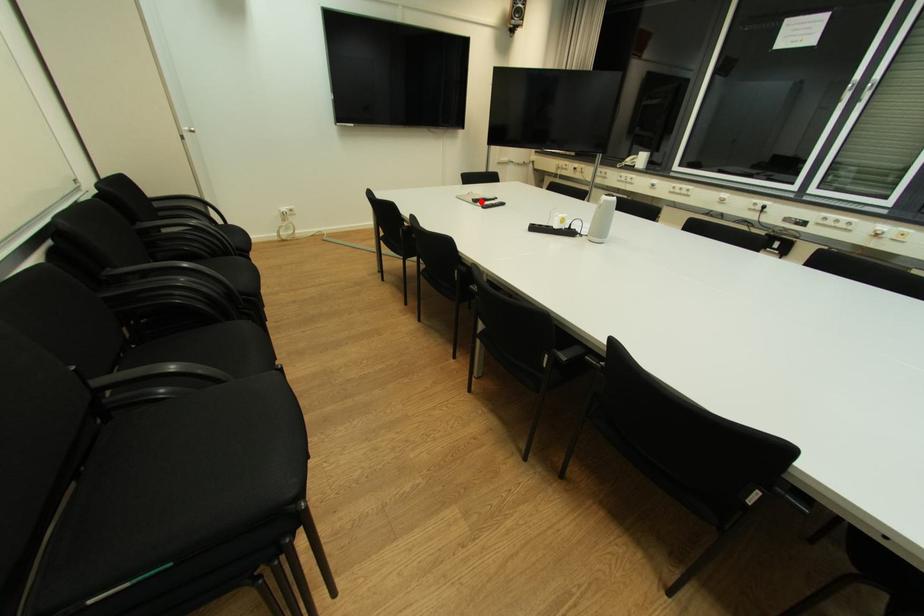
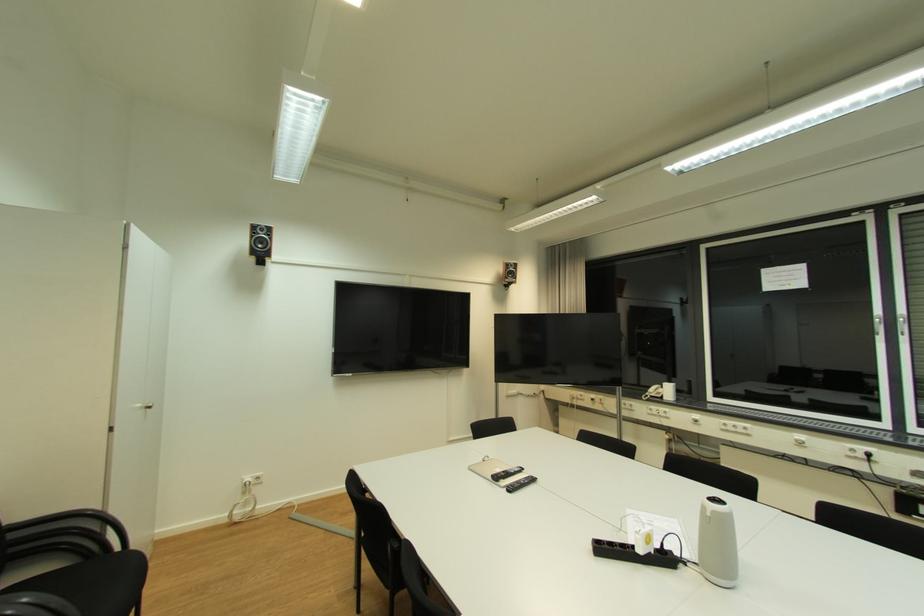
In the second image, find the point that corresponds to the highlighted location in the first image.

(502, 479)